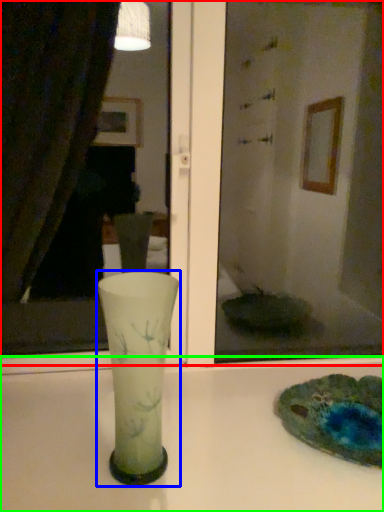
Question: Based on their relative distances, which object is nearer to mirror (highlighted by a red box)? Choose from vase (highlighted by a blue box) and counter top (highlighted by a green box).

Choices:
 (A) vase
 (B) counter top

Answer: (B)